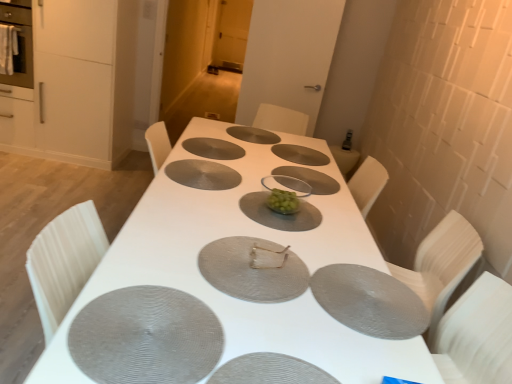
The height and width of the screenshot is (384, 512). Identify the location of free area below clear plastic plate at center (from a real-world perspective). (301, 175).